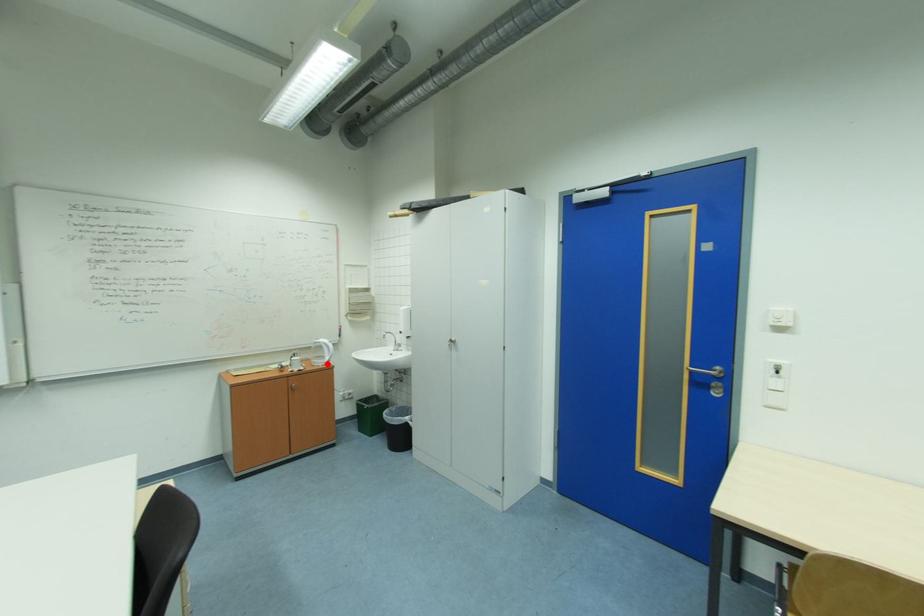
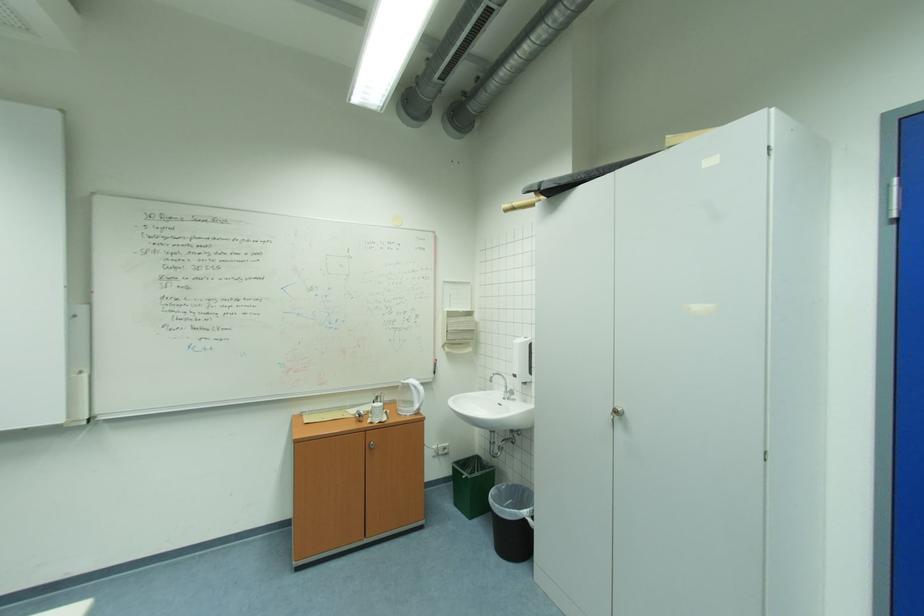
The point at the highlighted location is marked in the first image. Where is the corresponding point in the second image?

(415, 411)